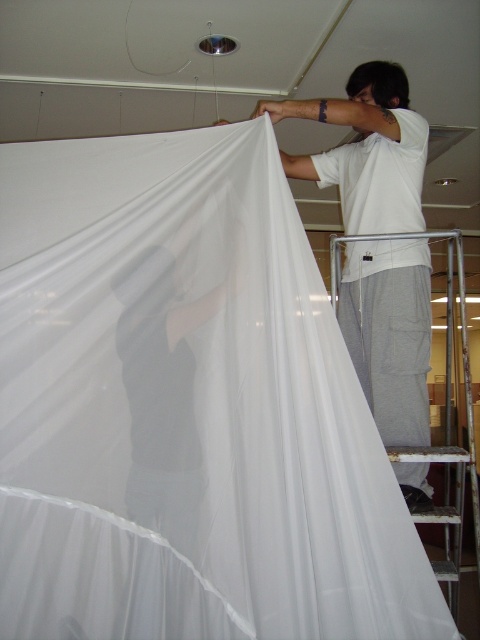
Question: Which object is closer to the camera taking this photo?

Choices:
 (A) white sheer fabric at upper right
 (B) black fabric at center

Answer: (B)

Question: Which point is farther from the camera taking this photo?

Choices:
 (A) (164, 312)
 (B) (408, 301)

Answer: (B)

Question: Among these objects, which one is farthest from the camera?

Choices:
 (A) white sheer fabric at upper right
 (B) black fabric at center

Answer: (A)

Question: Does white sheer fabric at upper right appear on the right side of black fabric at center?

Choices:
 (A) yes
 (B) no

Answer: (A)

Question: Is white sheer fabric at upper right thinner than black fabric at center?

Choices:
 (A) yes
 (B) no

Answer: (B)

Question: Can you confirm if white sheer fabric at upper right is positioned above black fabric at center?

Choices:
 (A) yes
 (B) no

Answer: (A)